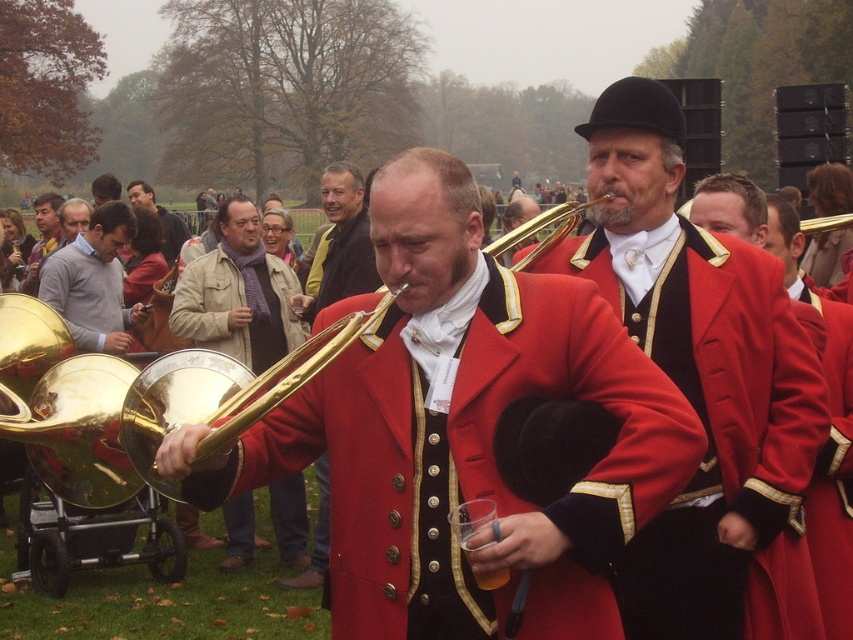
Question: Which object is farther from the camera taking this photo?

Choices:
 (A) matte black coat at center
 (B) gold brass instrument at center
 (C) matte brown jacket at upper left
 (D) light gray sweater at center

Answer: (C)

Question: Among these points, which one is farthest from the camera?

Choices:
 (A) (572, 212)
 (B) (361, 260)

Answer: (B)

Question: Which point is farther to the camera?

Choices:
 (A) shiny red coat at center
 (B) matte black coat at center
 (C) light gray sweater at center
 (D) gold brass instrument at center

Answer: (C)

Question: Can you confirm if gold brass instrument at center is bigger than shiny red coat at center?

Choices:
 (A) no
 (B) yes

Answer: (A)

Question: Does gold brass trumpet at center appear over matte brown jacket at upper left?

Choices:
 (A) yes
 (B) no

Answer: (B)

Question: From the image, what is the correct spatial relationship of matte black coat at center in relation to matte gold trumpet at center?

Choices:
 (A) right
 (B) left

Answer: (A)